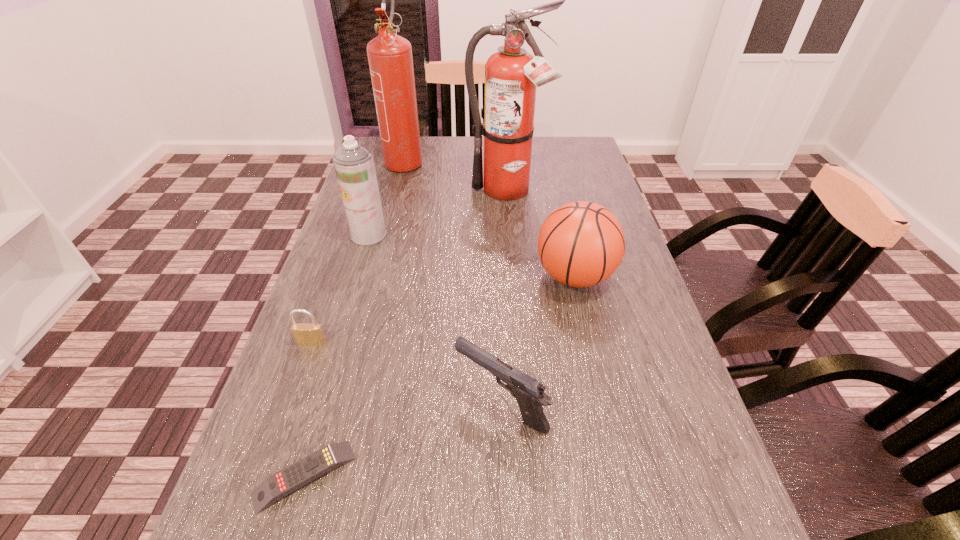
Find the location of a particular element. The height and width of the screenshot is (540, 960). the left fire extinguisher is located at coordinates (390, 59).

Where is `the right fire extinguisher`? the right fire extinguisher is located at coordinates (512, 75).

Where is `aerosol can`? This screenshot has height=540, width=960. aerosol can is located at coordinates point(354,165).

Identify the location of the third tallest object. (354, 165).

The image size is (960, 540). Find the location of `the fourth farthest object`. the fourth farthest object is located at coordinates [x=581, y=244].

The image size is (960, 540). What are the coordinates of `the fourth shortest object` in the screenshot? It's located at (581, 244).

Locate an element on the screen. the third shortest object is located at coordinates (529, 393).

Locate an element on the screen. The height and width of the screenshot is (540, 960). the sixth farthest object is located at coordinates (529, 393).

This screenshot has width=960, height=540. I want to click on the third nearest object, so click(304, 333).

Locate an element on the screen. This screenshot has height=540, width=960. padlock is located at coordinates 304,333.